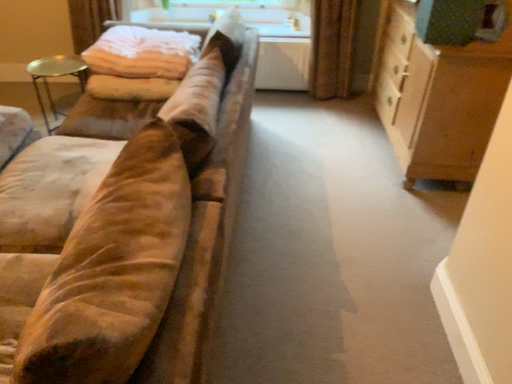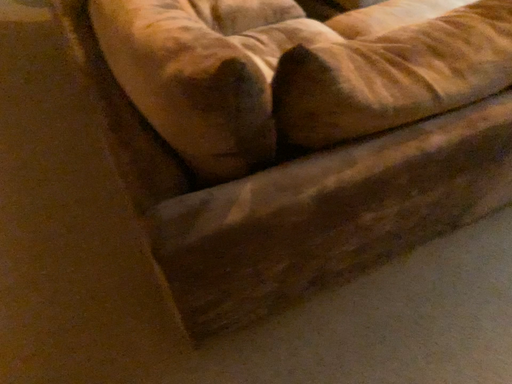
Question: Which way did the camera rotate in the video?

Choices:
 (A) rotated left
 (B) rotated right

Answer: (A)